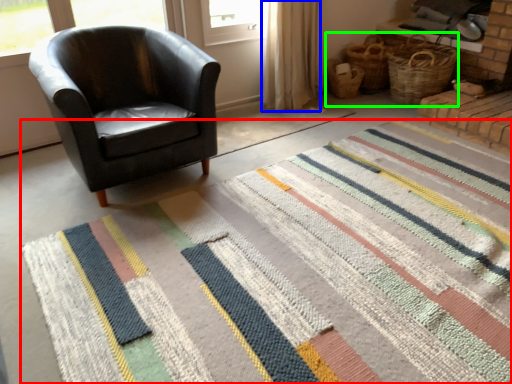
Question: Which object is the farthest from doormat (highlighted by a red box)? Choose among these: curtain (highlighted by a blue box) or basket (highlighted by a green box).

Choices:
 (A) curtain
 (B) basket

Answer: (B)